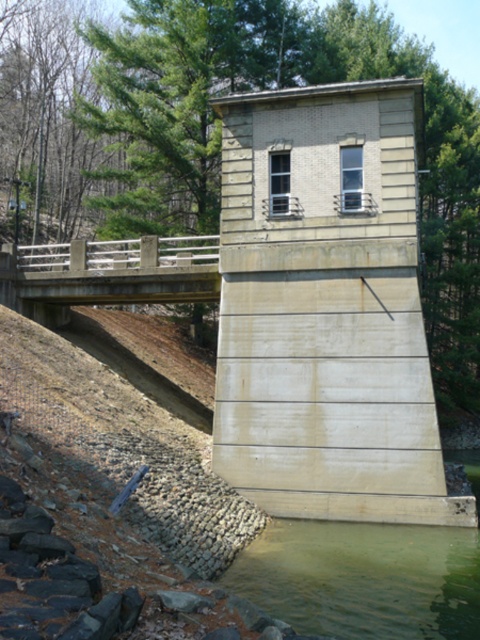
Question: Is greenish concrete water at lower center behind concrete bridge at center?

Choices:
 (A) yes
 (B) no

Answer: (B)

Question: Is greenish concrete water at lower center bigger than concrete bridge at center?

Choices:
 (A) no
 (B) yes

Answer: (A)

Question: In this image, where is greenish concrete water at lower center located relative to concrete bridge at center?

Choices:
 (A) left
 (B) right

Answer: (B)